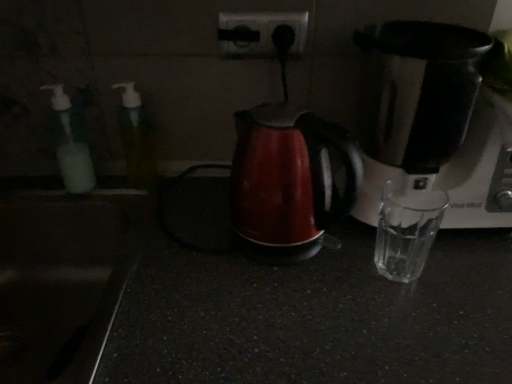
Question: Choose the correct answer: Is translucent plastic soap dispenser at left, the 1th bottle viewed from the left, inside matte red kettle at center or outside it?

Choices:
 (A) outside
 (B) inside

Answer: (A)

Question: Is translucent plastic soap dispenser at left, the 2th bottle positioned from the right, in front of or behind matte red kettle at center in the image?

Choices:
 (A) behind
 (B) front

Answer: (A)

Question: Considering the real-world distances, which object is closest to the translucent plastic bottle at left, placed as the first bottle when sorted from right to left?

Choices:
 (A) matte red kettle at center
 (B) black glossy sink at lower left
 (C) satin black coffee maker at right
 (D) black plastic power plugs and sockets at upper center
 (E) translucent plastic soap dispenser at left, the 2th bottle positioned from the right

Answer: (E)

Question: Considering the real-world distances, which object is closest to the matte red kettle at center?

Choices:
 (A) translucent plastic bottle at left, placed as the first bottle when sorted from right to left
 (B) satin black coffee maker at right
 (C) translucent plastic soap dispenser at left, the 1th bottle viewed from the left
 (D) black plastic power plugs and sockets at upper center
 (E) black glossy sink at lower left

Answer: (B)